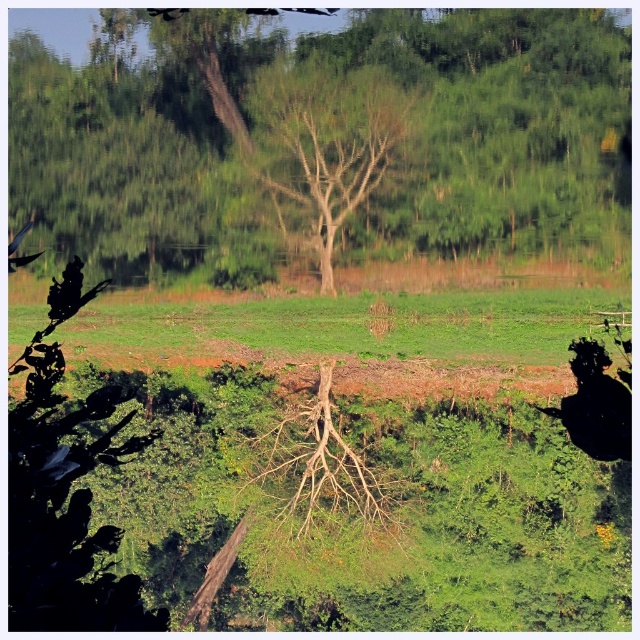
Who is positioned more to the left, green leafy tree at center or bare wood tree at center?

green leafy tree at center is more to the left.

Between point (541, 100) and point (266, 90), which one is positioned in front?

Point (541, 100)

Describe the element at coordinates (324, 141) in the screenshot. The width and height of the screenshot is (640, 640). I see `green leafy tree at center` at that location.

Locate an element on the screen. This screenshot has height=640, width=640. green leafy tree at center is located at coordinates (324, 141).

Is green leafy tree at center above green grassy field at center?

Indeed, green leafy tree at center is positioned over green grassy field at center.

Is point (620, 51) in front of point (131, 308)?

Yes, point (620, 51) is in front of point (131, 308).

Locate an element on the screen. The width and height of the screenshot is (640, 640). green leafy tree at center is located at coordinates (324, 141).

Who is more distant from viewer, (394, 324) or (316, 77)?

Point (394, 324)

Which is above, green grassy field at center or bare wood tree at center?

Positioned higher is bare wood tree at center.

Is point (444, 326) farther from camera compared to point (282, 188)?

Yes, point (444, 326) is farther from viewer.

The image size is (640, 640). I want to click on green grassy field at center, so click(x=355, y=324).